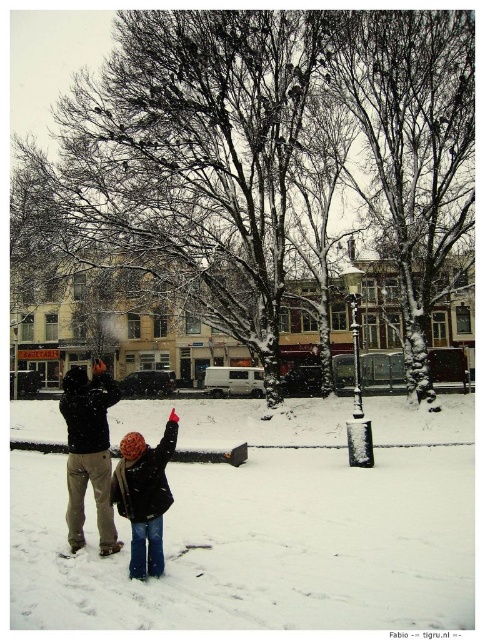
Can you confirm if white fluffy snow at center is taller than black woolen hat at center?

In fact, white fluffy snow at center may be shorter than black woolen hat at center.

Is white fluffy snow at center closer to camera compared to black woolen hat at center?

Yes.

Who is more distant from viewer, (147, 416) or (131, 545)?

The point (147, 416) is more distant.

At what (x,y) coordinates should I click in order to perform the action: click on white fluffy snow at center. Please return your answer as a coordinate pair (x, y). The height and width of the screenshot is (640, 485). Looking at the image, I should click on (268, 525).

Is point (337, 609) in front of point (67, 532)?

Yes, it is in front of point (67, 532).

Does white fluffy snow at center have a smaller size compared to dark brown leather jacket at center?

Correct, white fluffy snow at center occupies less space than dark brown leather jacket at center.

Where is `white fluffy snow at center`? white fluffy snow at center is located at coordinates (268, 525).

Which of these two, dark brown leather jacket at center or black woolen hat at center, stands taller?

dark brown leather jacket at center

From the picture: Which is more to the right, dark brown leather jacket at center or black woolen hat at center?

Positioned to the right is black woolen hat at center.

Between point (97, 506) and point (138, 561), which one is positioned in front?

Positioned in front is point (138, 561).

Image resolution: width=485 pixels, height=640 pixels. I want to click on dark brown leather jacket at center, so click(x=89, y=452).